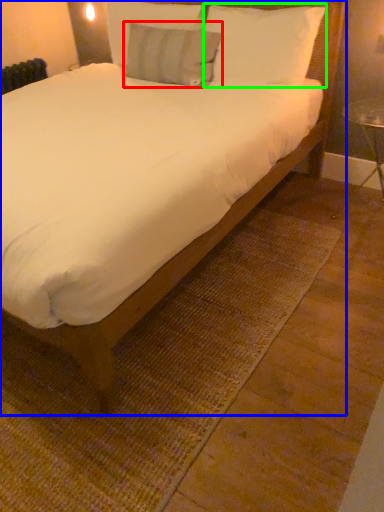
Question: Which object is the farthest from pillow (highlighted by a red box)? Choose among these: bed (highlighted by a blue box) or pillow (highlighted by a green box).

Choices:
 (A) bed
 (B) pillow

Answer: (A)